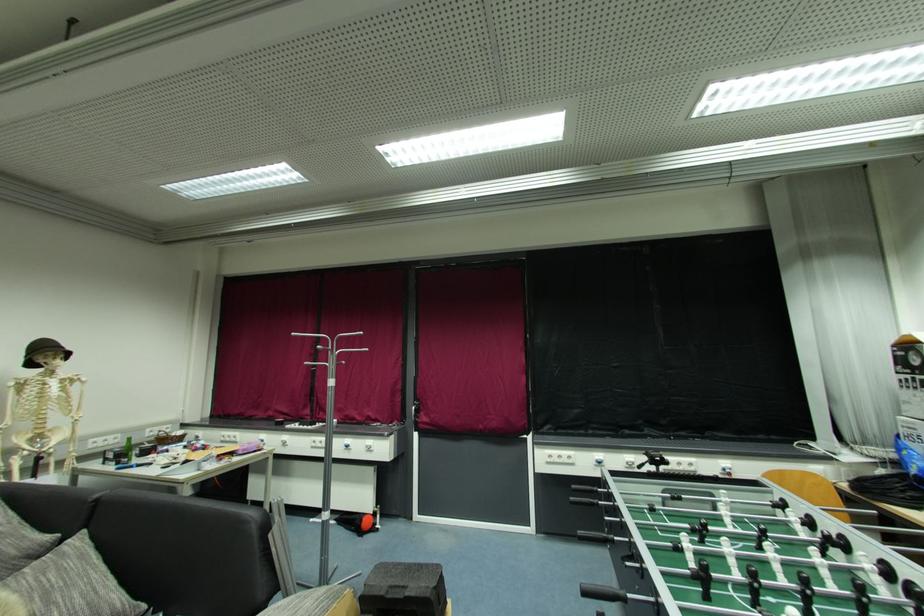
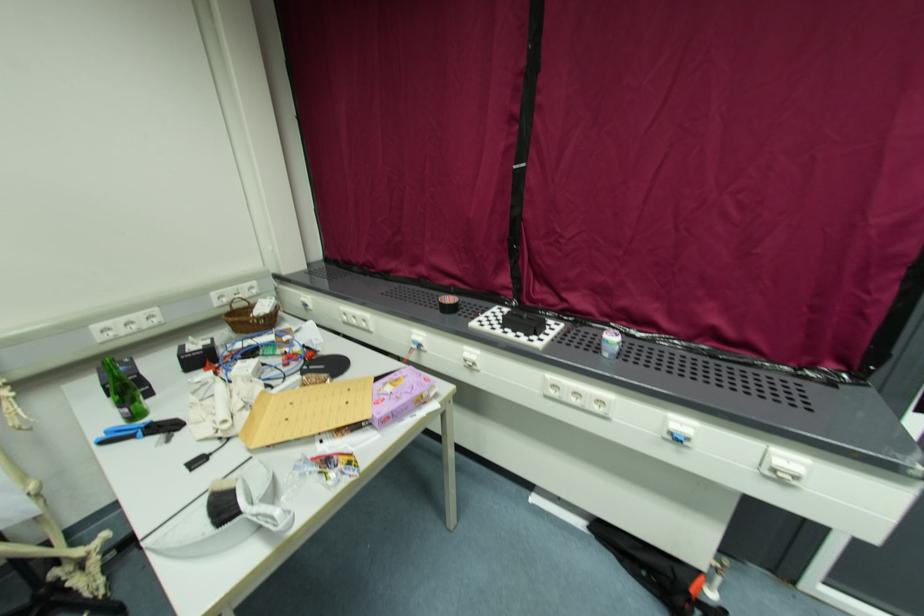
Locate, in the second image, the point that corresponds to (x=288, y=438) in the first image.

(476, 352)